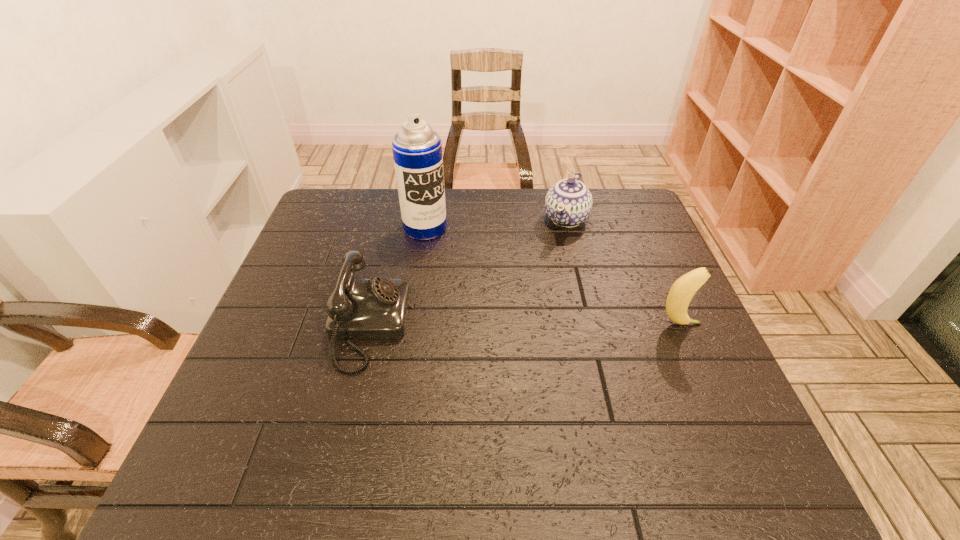
You are a GUI agent. You are given a task and a screenshot of the screen. Output one action in this format:
    pyautogui.click(x=<x>, y=<y>)
    Task: Click on the telephone
    This screenshot has width=960, height=540.
    Given the screenshot: What is the action you would take?
    pyautogui.click(x=377, y=308)

Where is `the third shortest object`? the third shortest object is located at coordinates (683, 289).

Where is `the rightmost object`? the rightmost object is located at coordinates (683, 289).

This screenshot has height=540, width=960. I want to click on aerosol can, so click(x=417, y=149).

Find the location of a particular element. This screenshot has height=540, width=960. the second object from right to left is located at coordinates (568, 203).

I want to click on blank space located on the dial of the telephone, so click(469, 325).

Identify the location of free region located on the label side of the tallest object. (463, 279).

The height and width of the screenshot is (540, 960). I want to click on vacant area located 0.270m on the label side of the tallest object, so click(x=477, y=298).

Find the location of `vacant area situated 0.340m on the label side of the tallest object`. vacant area situated 0.340m on the label side of the tallest object is located at coordinates (491, 316).

At what (x,y) coordinates should I click in order to perform the action: click on free point located at the spout of the second object from right to left. Please return your answer as a coordinate pair (x, y). The width and height of the screenshot is (960, 540). Looking at the image, I should click on (519, 325).